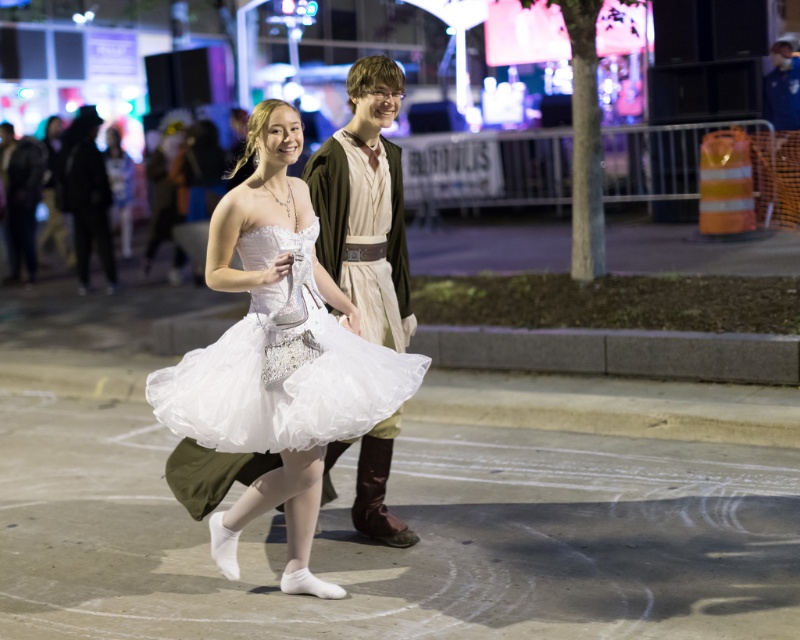
You are a photographer at the event and want to capture a photo of both the white tulle dress at center and the brown leather belt at center in the same frame. The camera has a focal length of 50mm. Considering the distance between them, do you think this focal length will allow both objects to be in the frame without cropping?

The white tulle dress at center and brown leather belt at center are 38.74 inches apart. At 50mm focal length, this distance is manageable within the frame, so yes, both objects can be captured without cropping.

You are standing at the center of the scene and want to hand a gift to both the brown leather belt at center and the matte white dress at center. Since you can only move forward in a straight line, which one will you reach first?

The brown leather belt at center is closer to you than the matte white dress at center, so you will reach the brown leather belt at center first.

You are standing at the point labeled point (x=296, y=358) and want to move to the left. Is there enough space to walk freely without bumping into the woman in the white strapless tulle dress with fitted bodice?

The point labeled point (x=296, y=358) is 6.28 meters away from the viewer, so there is sufficient space to walk freely to the left without bumping into the woman in the white strapless tulle dress with fitted bodice.